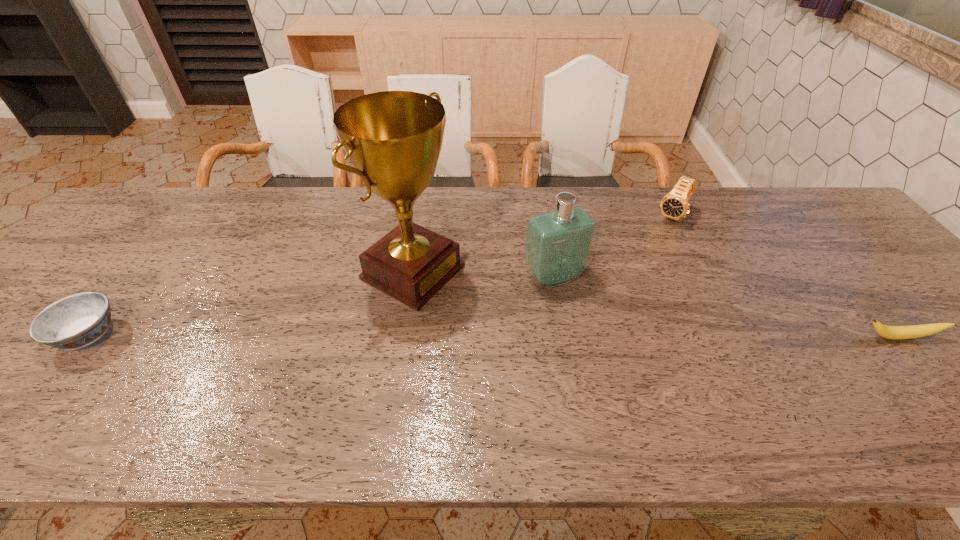
Locate an element on the screen. The height and width of the screenshot is (540, 960). vacant space on the desktop that is between the leftmost object and the banana and is positioned on the plaque of the award is located at coordinates (534, 336).

The height and width of the screenshot is (540, 960). What are the coordinates of `free space on the desktop that is between the ashtray and the banana and is positioned on the face of the second object from right to left` in the screenshot? It's located at (588, 336).

Identify the location of free space on the desktop that is between the leftmost object and the rightmost object and is positioned on the front label of the third object from right to left. This screenshot has height=540, width=960. (594, 336).